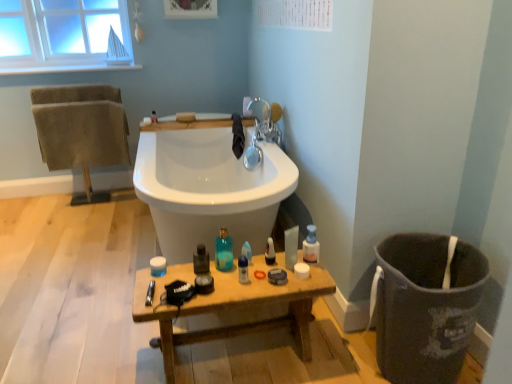
You are a GUI agent. You are given a task and a screenshot of the screen. Output one action in this format:
    pyautogui.click(x=<x>, y=<y>)
    Task: Click on the unoccupied area in front of translucent plastic spray bottle at center, arranged as the second cleaning product when viewed from the right
    
    Given the screenshot: What is the action you would take?
    pyautogui.click(x=246, y=279)